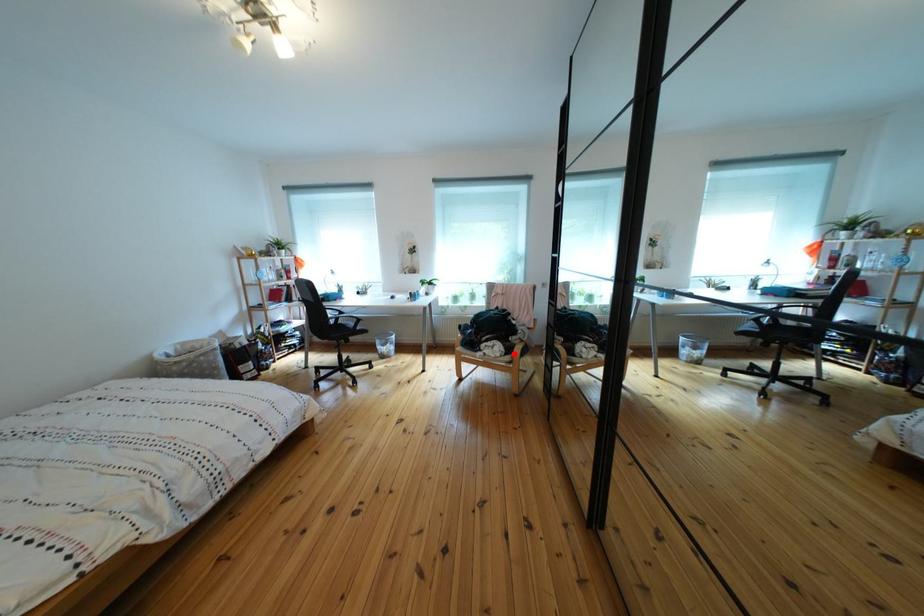
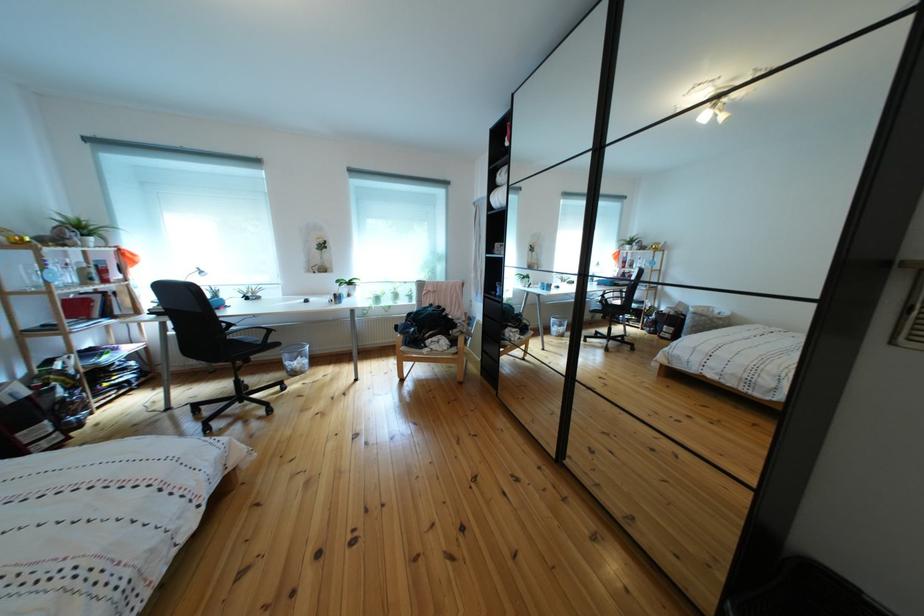
The point at the highlighted location is marked in the first image. Where is the corresponding point in the second image?

(458, 347)